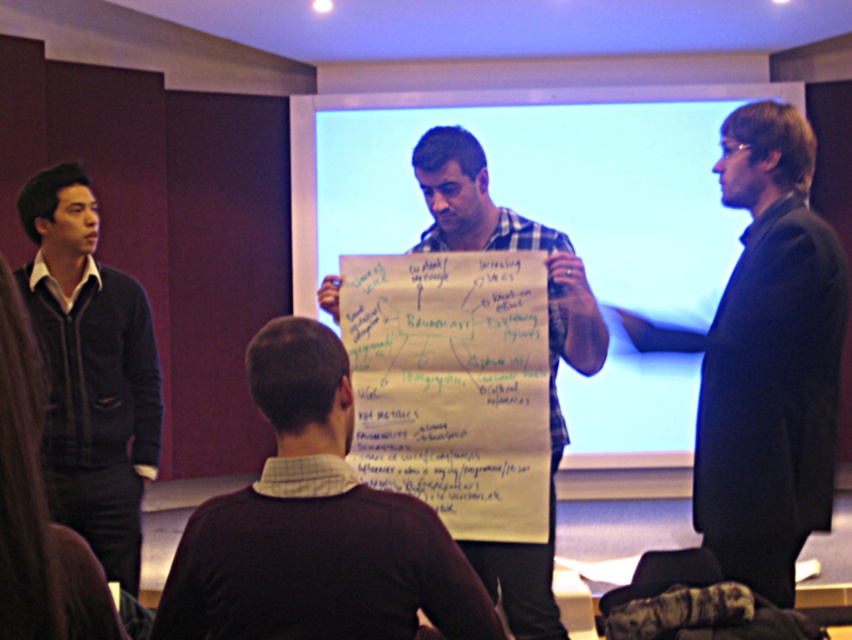
Can you confirm if velvet dark blue sweater at left is positioned to the right of white paperboard at center?

No, velvet dark blue sweater at left is not to the right of white paperboard at center.

Can you confirm if velvet dark blue sweater at left is positioned above white paperboard at center?

No.

Where is `velvet dark blue sweater at left`? velvet dark blue sweater at left is located at coordinates (90, 371).

In order to click on velvet dark blue sweater at left in this screenshot , I will do `click(90, 371)`.

Can you confirm if whiteboard at center is taller than black smooth suit at right?

Indeed, whiteboard at center has a greater height compared to black smooth suit at right.

Identify the location of whiteboard at center. (560, 228).

You are a GUI agent. You are given a task and a screenshot of the screen. Output one action in this format:
    pyautogui.click(x=<x>, y=<y>)
    Task: Click on the whiteboard at center
    This screenshot has height=640, width=852.
    Given the screenshot: What is the action you would take?
    pyautogui.click(x=560, y=228)

Who is positioned more to the left, black smooth suit at right or velvet dark blue sweater at left?

Positioned to the left is velvet dark blue sweater at left.

Is point (755, 285) closer to camera compared to point (79, 368)?

That is True.

Identify the location of black smooth suit at right. The width and height of the screenshot is (852, 640). (766, 358).